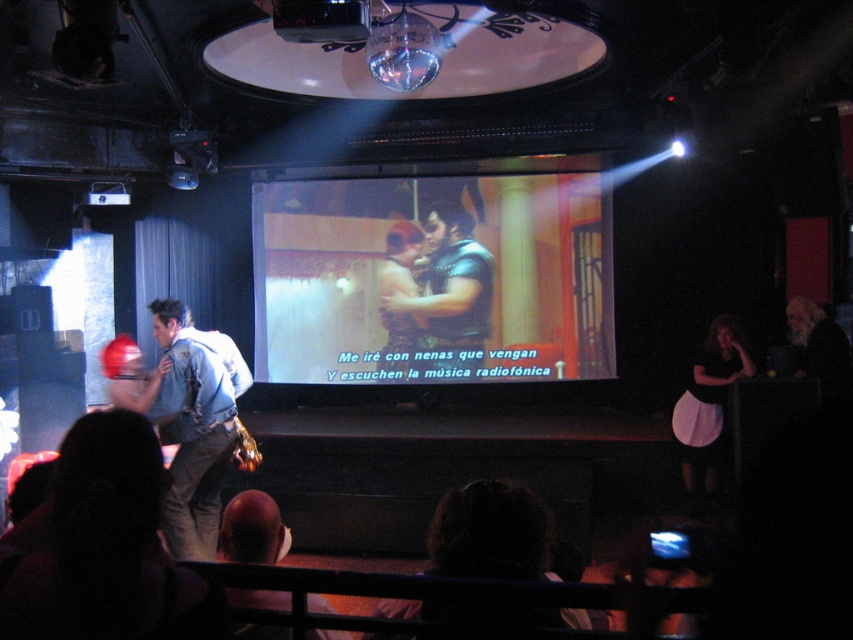
You are a stagehand preparing for a performance. You need to place a new microphone stand between the white cotton apron at lower right and the black plastic projector at upper center. Based on their positions, can you determine which side of the apron the microphone stand should be placed?

The white cotton apron at lower right is to the right of the black plastic projector at upper center, so the microphone stand should be placed to the left of the white cotton apron at lower right to position it between the two objects.

You are a stagehand in a theater. You need to hang a decorative banner that is 1.5 meters wide between the matte black screen at center and the white cotton apron at lower right. Can you fit it there?

The matte black screen at center is located above the white cotton apron at lower right, so the banner can be hung between them vertically. Since the banner is 1.5 meters wide and the vertical space between the two objects allows for that width, it should fit.

You are a photographer at the nightclub. You need to capture a photo of the matte black dress at center and the smooth leather jacket at lower center. Which object should you focus on first if you want to ensure both are in the frame without moving the camera?

The matte black dress at center has a larger size compared to the smooth leather jacket at lower center, so you should focus on the matte black dress at center first to ensure it fits within the frame before adjusting for the smaller jacket.